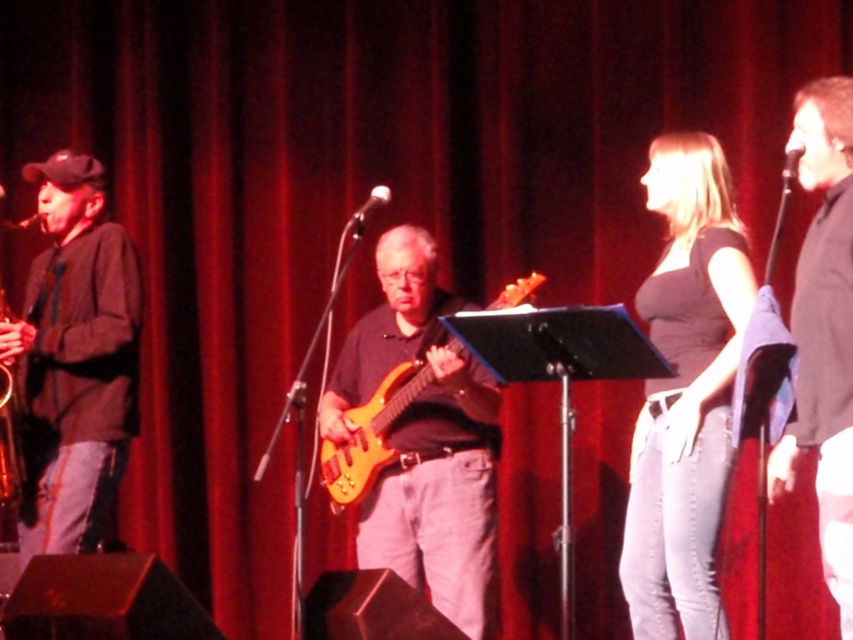
Measure the distance from matte black jacket at left to glossy wood guitar at center.

A distance of 37.82 inches exists between matte black jacket at left and glossy wood guitar at center.

Is matte black jacket at left below glossy wood guitar at center?

No, matte black jacket at left is not below glossy wood guitar at center.

Which is behind, point (125, 413) or point (369, 406)?

Positioned behind is point (369, 406).

You are a GUI agent. You are given a task and a screenshot of the screen. Output one action in this format:
    pyautogui.click(x=<x>, y=<y>)
    Task: Click on the matte black jacket at left
    
    Given the screenshot: What is the action you would take?
    pyautogui.click(x=76, y=360)

Can you confirm if matte black jacket at left is thinner than black matte shirt at center?

No.

Between matte black jacket at left and black matte shirt at center, which one has less height?

Standing shorter between the two is matte black jacket at left.

Locate an element on the screen. matte black jacket at left is located at coordinates (76, 360).

Can you confirm if matte black top at center is positioned below glossy wood guitar at center?

No.

Does point (740, 227) come farther from viewer compared to point (328, 467)?

No.

The width and height of the screenshot is (853, 640). I want to click on matte black top at center, so click(x=685, y=392).